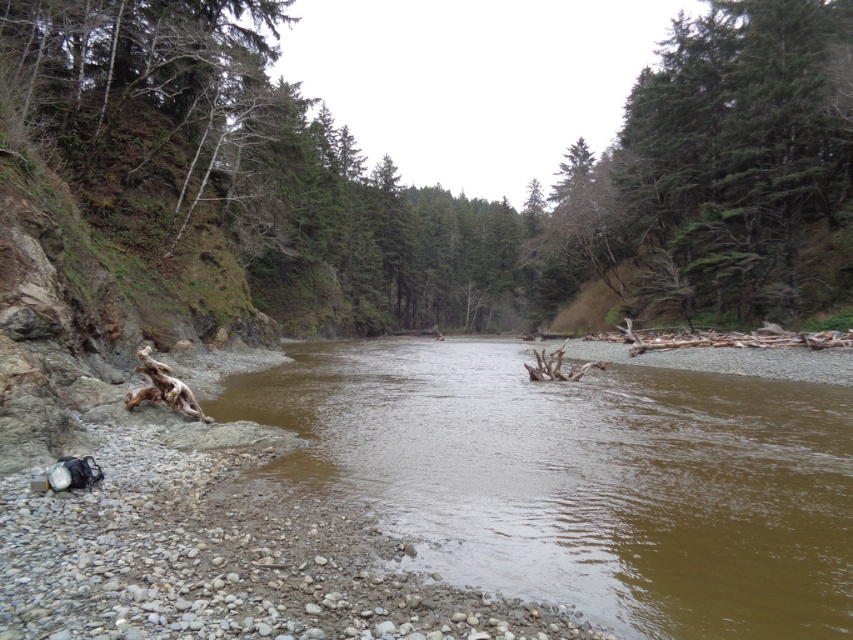
You are standing at the edge of the river and want to take a photo of both the brown muddy water at center and the green textured tree at upper right. Which object will appear larger in your photo?

The brown muddy water at center will appear larger in the photo because it is closer to the viewer than the green textured tree at upper right.

You are a kayaker planning to navigate the river shown in the image. You see the brown muddy water at center and the green textured tree at upper right. Which object is positioned higher in the scene?

The green textured tree at upper right is positioned higher in the scene than the brown muddy water at center, as the water is located below the tree.

You are standing at the riverbank in the scene and want to reach a specific point marked at coordinates point (416, 429). If your maximum comfortable walking distance is 15 meters, can you comfortably reach that point without straying too far?

The point (416, 429) is 13.59 meters from the viewer, which is within your maximum comfortable walking distance of 15 meters. Therefore, you can comfortably reach it without straying too far.